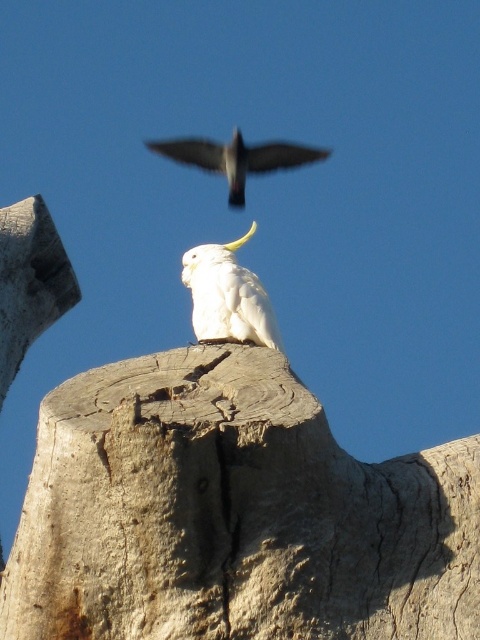
Consider the image. You are a birdwatcher standing at the edge of a forest clearing. You see the light brown rough wood at center and the white matte parrot at center. If you want to observe both objects clearly, which one should you focus on first, and why?

You should focus on the white matte parrot at center first because it is closer to you than the light brown rough wood at center. The distance between them is 78.04 feet, so the parrot is nearer and easier to observe clearly.

You are a birdwatcher observing the scene. You notice the light brown rough wood at center and the white matte parrot at center. Which object is positioned lower in the image?

The light brown rough wood at center is positioned lower than the white matte parrot at center.